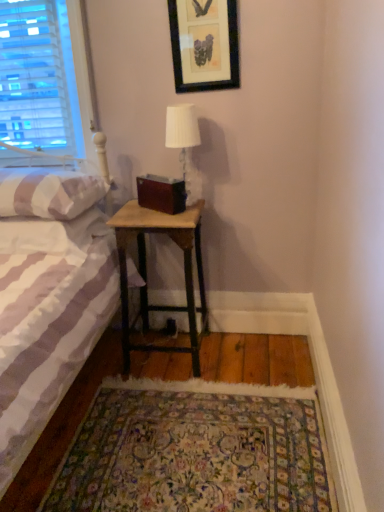
You are a GUI agent. You are given a task and a screenshot of the screen. Output one action in this format:
    pyautogui.click(x=<x>, y=<y>)
    Task: Click on the free space that is to the left of woodenmaterial/texturenightstand at lower center
    
    Given the screenshot: What is the action you would take?
    pyautogui.click(x=104, y=373)